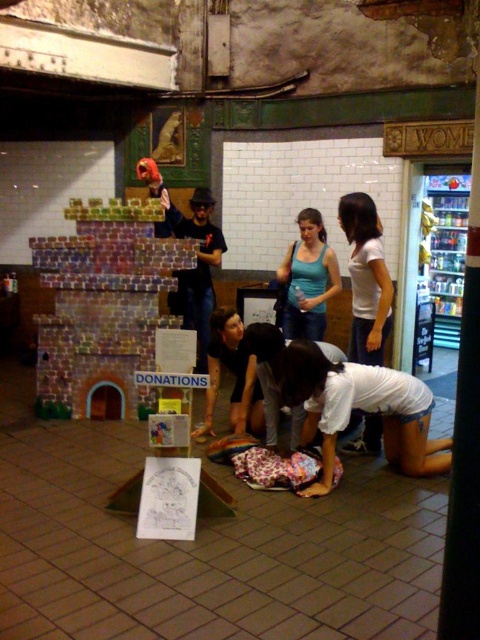
You are a photographer trying to capture the person building the castle. Based on the scene, which clothing item is closer to the camera between the white matte shirt at center and the matte blue tank top at center?

The white matte shirt at center is located below the matte blue tank top at center, which means the white matte shirt is closer to the camera since it is positioned lower in the image.

You are a delivery robot with a package that needs to be placed between the multicolored cardboard castle at left and the white matte shirt at center. The robot requires at least 4 feet of space to maneuver. Can you safely place the package there?

The multicolored cardboard castle at left and white matte shirt at center are 5.38 feet apart, which is more than the required 4 feet of space. Therefore, the delivery robot can safely place the package between them.